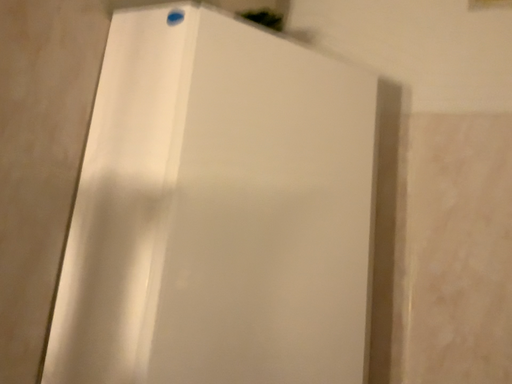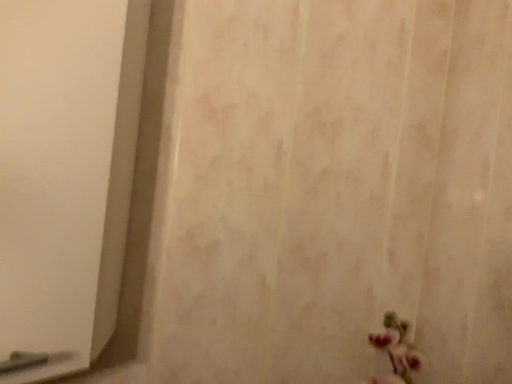
Question: Which way did the camera rotate in the video?

Choices:
 (A) rotated left
 (B) rotated right

Answer: (B)